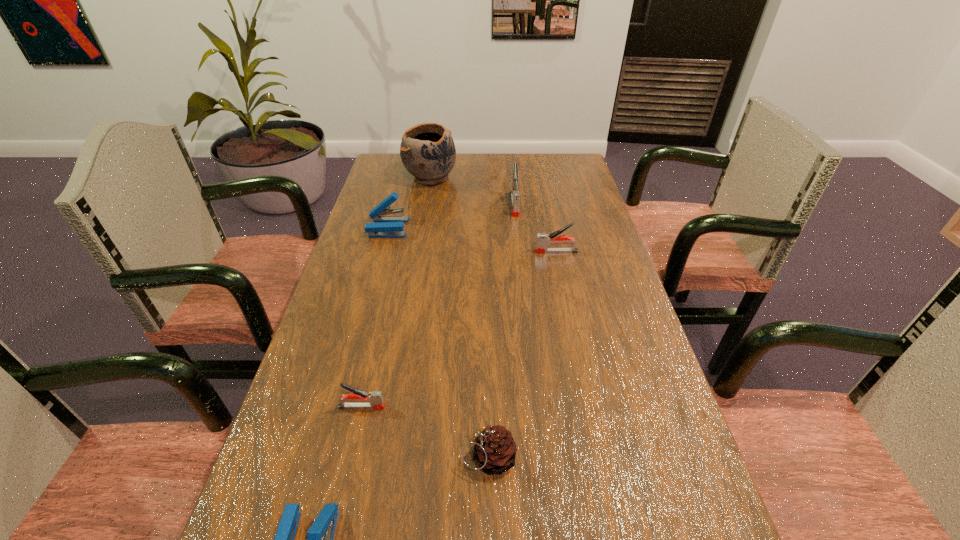
Identify the location of the third closest gray stapler relative to the second nearest object. The height and width of the screenshot is (540, 960). (515, 195).

Find the location of `vacant space that satisfies the following two spatial constraints: 1. on the front side of the tallest object; 2. on the handle side of the leftmost gray stapler`. vacant space that satisfies the following two spatial constraints: 1. on the front side of the tallest object; 2. on the handle side of the leftmost gray stapler is located at coordinates (390, 407).